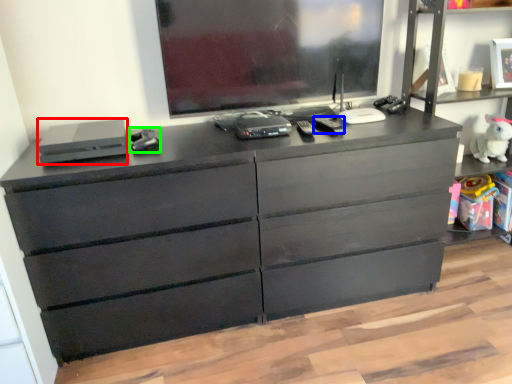
Question: Which is farther away from equipment (highlighted by a red box)? equipment (highlighted by a blue box) or equipment (highlighted by a green box)?

Choices:
 (A) equipment
 (B) equipment

Answer: (A)